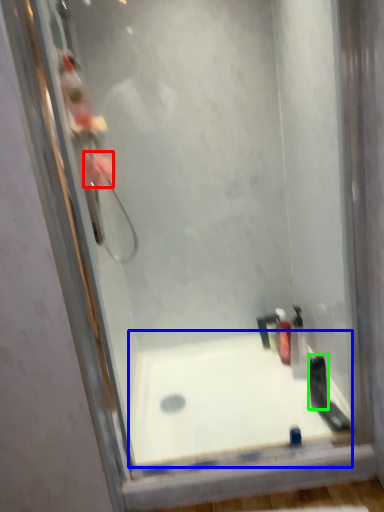
Question: Based on their relative distances, which object is farther from flower (highlighted by a red box)? Choose from bathtub (highlighted by a blue box) and toiletry (highlighted by a green box).

Choices:
 (A) bathtub
 (B) toiletry

Answer: (B)